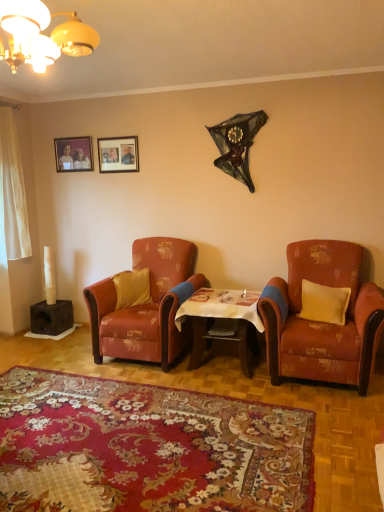
Identify the location of floral carpet at center. (147, 448).

Measure the distance between yellow fabric pillow at center, the second pillow when ordered from right to left, and camera.

yellow fabric pillow at center, the second pillow when ordered from right to left, and camera are 3.79 meters apart from each other.

This screenshot has width=384, height=512. Describe the element at coordinates (132, 288) in the screenshot. I see `yellow fabric pillow at center, the second pillow when ordered from right to left` at that location.

Find the location of a particular element. distressed fabric armchair at center, placed as the second chair when sorted from right to left is located at coordinates (145, 306).

Can you confirm if yellow fabric pillow at center, the second pillow when ordered from right to left, is smaller than floral carpet at center?

Yes.

Which is more to the right, yellow fabric pillow at center, the second pillow when ordered from right to left, or floral carpet at center?

floral carpet at center is more to the right.

Consider the image. From the image's perspective, relative to floral carpet at center, is yellow fabric pillow at center, the second pillow when ordered from right to left, above or below?

Clearly, from the image's perspective, yellow fabric pillow at center, the second pillow when ordered from right to left, is above floral carpet at center.

Is yellow velvet pillow at right, the second pillow positioned from the back, in contact with matte wooden picture frame at upper left, which ranks as the first picture frame in left-to-right order?

There is a gap between yellow velvet pillow at right, the second pillow positioned from the back, and matte wooden picture frame at upper left, which ranks as the first picture frame in left-to-right order.

Is yellow velvet pillow at right, which ranks as the 1th pillow in front-to-back order, inside or outside of matte wooden picture frame at upper left, which ranks as the second picture frame in right-to-left order?

yellow velvet pillow at right, which ranks as the 1th pillow in front-to-back order, is located beyond the bounds of matte wooden picture frame at upper left, which ranks as the second picture frame in right-to-left order.

From a real-world perspective, who is located higher, yellow velvet pillow at right, which ranks as the 1th pillow in front-to-back order, or matte wooden picture frame at upper left, which ranks as the first picture frame in left-to-right order?

matte wooden picture frame at upper left, which ranks as the first picture frame in left-to-right order, from a real-world perspective.

Is yellow velvet pillow at right, which ranks as the 1th pillow in front-to-back order, oriented towards matte wooden picture frame at upper left, which ranks as the second picture frame in right-to-left order?

No, yellow velvet pillow at right, which ranks as the 1th pillow in front-to-back order, does not turn towards matte wooden picture frame at upper left, which ranks as the second picture frame in right-to-left order.

Considering the relative sizes of distressed fabric armchair at center, the first chair from the left, and wooden table at center in the image provided, is distressed fabric armchair at center, the first chair from the left, bigger than wooden table at center?

Correct, distressed fabric armchair at center, the first chair from the left, is larger in size than wooden table at center.

Considering the positions of points (187, 264) and (204, 342), is point (187, 264) farther from camera compared to point (204, 342)?

Yes, it is.

In the scene shown: Is distressed fabric armchair at center, placed as the second chair when sorted from right to left, not within wooden table at center?

distressed fabric armchair at center, placed as the second chair when sorted from right to left, lies outside wooden table at center's area.

How far apart are distressed fabric armchair at center, the first chair from the left, and wooden table at center?

distressed fabric armchair at center, the first chair from the left, and wooden table at center are 15.21 inches apart from each other.

Considering the positions of point (150, 245) and point (32, 49), is point (150, 245) closer or farther from the camera than point (32, 49)?

Point (150, 245) is farther from the camera than point (32, 49).

Identify the location of the 1st chair counting from the right side of the metallic yellow chandelier at upper left. The image size is (384, 512). (145, 306).

Is distressed fabric armchair at center, the first chair from the left, oriented away from metallic yellow chandelier at upper left?

distressed fabric armchair at center, the first chair from the left, is not turned away from metallic yellow chandelier at upper left.

From the image's perspective, which is below, distressed fabric armchair at center, placed as the second chair when sorted from right to left, or metallic yellow chandelier at upper left?

distressed fabric armchair at center, placed as the second chair when sorted from right to left, from the image's perspective.

How many degrees apart are the facing directions of matte wooden picture frame at upper center, acting as the second picture frame starting from the left, and metallic yellow chandelier at upper left?

The angle between the facing direction of matte wooden picture frame at upper center, acting as the second picture frame starting from the left, and the facing direction of metallic yellow chandelier at upper left is 90 degrees.

Does matte wooden picture frame at upper center, which is the 1th picture frame in right-to-left order, lie behind metallic yellow chandelier at upper left?

Yes, the depth of matte wooden picture frame at upper center, which is the 1th picture frame in right-to-left order, is greater than that of metallic yellow chandelier at upper left.

Which of these two, matte wooden picture frame at upper center, acting as the second picture frame starting from the left, or metallic yellow chandelier at upper left, is smaller?

matte wooden picture frame at upper center, acting as the second picture frame starting from the left.

Which object is positioned more to the right, matte wooden picture frame at upper center, which is the 1th picture frame in right-to-left order, or metallic yellow chandelier at upper left?

Positioned to the right is metallic yellow chandelier at upper left.

From the image's perspective, is yellow fabric pillow at center, the second pillow when ordered from right to left, on distressed orange fabric armchair at right, the first chair from the right?

Yes, from the image's perspective, yellow fabric pillow at center, the second pillow when ordered from right to left, is over distressed orange fabric armchair at right, the first chair from the right.

Starting from the yellow fabric pillow at center, placed as the first pillow when sorted from back to front, which chair is the 2nd one in front? Please provide its 2D coordinates.

[(324, 323)]

Is distressed orange fabric armchair at right, arranged as the second chair when viewed from the left, inside yellow fabric pillow at center, placed as the first pillow when sorted from back to front?

Definitely not — distressed orange fabric armchair at right, arranged as the second chair when viewed from the left, is not inside yellow fabric pillow at center, placed as the first pillow when sorted from back to front.

Which of these two, yellow fabric pillow at center, which is the first pillow in left-to-right order, or distressed orange fabric armchair at right, the first chair from the right, is bigger?

distressed orange fabric armchair at right, the first chair from the right.

Is floral carpet at center placed right next to distressed fabric armchair at center, the first chair from the left?

No, floral carpet at center is not with distressed fabric armchair at center, the first chair from the left.

Is floral carpet at center oriented towards distressed fabric armchair at center, the first chair from the left?

No.

Is the position of floral carpet at center less distant than that of distressed fabric armchair at center, the first chair from the left?

Yes, it is in front of distressed fabric armchair at center, the first chair from the left.

From the image's perspective, which is above, floral carpet at center or distressed fabric armchair at center, the first chair from the left?

distressed fabric armchair at center, the first chair from the left.

Where is `the 2nd pillow positioned above the floral carpet at center (from a real-world perspective)`? Image resolution: width=384 pixels, height=512 pixels. the 2nd pillow positioned above the floral carpet at center (from a real-world perspective) is located at coordinates (132, 288).

Which picture frame is the 2nd one when counting from the left side of the yellow velvet pillow at right, which ranks as the 1th pillow in front-to-back order? Please provide its 2D coordinates.

[(73, 154)]

Based on their spatial positions, is wooden table at center or yellow fabric pillow at center, which is the first pillow in left-to-right order, closer to metallic yellow chandelier at upper left?

yellow fabric pillow at center, which is the first pillow in left-to-right order, is positioned closer to the anchor metallic yellow chandelier at upper left.

Consider the image. When comparing their distances from distressed fabric armchair at center, the first chair from the left, does wooden table at center or matte wooden picture frame at upper center, acting as the second picture frame starting from the left, seem closer?

Based on the image, wooden table at center appears to be nearer to distressed fabric armchair at center, the first chair from the left.

When comparing their distances from metallic yellow chandelier at upper left, does matte wooden picture frame at upper center, which is the 1th picture frame in right-to-left order, or distressed fabric armchair at center, placed as the second chair when sorted from right to left, seem closer?

distressed fabric armchair at center, placed as the second chair when sorted from right to left.

Looking at the image, which one is located further to floral carpet at center, wooden table at center or matte wooden picture frame at upper left, which ranks as the first picture frame in left-to-right order?

matte wooden picture frame at upper left, which ranks as the first picture frame in left-to-right order, is further to floral carpet at center.

Looking at this image, which object lies nearer to the anchor point yellow velvet pillow at right, the second pillow positioned from the back, matte wooden picture frame at upper center, which is the 1th picture frame in right-to-left order, or distressed orange fabric armchair at right, arranged as the second chair when viewed from the left?

Among the two, distressed orange fabric armchair at right, arranged as the second chair when viewed from the left, is located nearer to yellow velvet pillow at right, the second pillow positioned from the back.

Estimate the real-world distances between objects in this image. Which object is further from metallic yellow chandelier at upper left, yellow velvet pillow at right, the first pillow from the right, or matte wooden picture frame at upper left, which ranks as the first picture frame in left-to-right order?

yellow velvet pillow at right, the first pillow from the right.

Which object lies further to the anchor point yellow velvet pillow at right, arranged as the 2th pillow when viewed from the left, metallic yellow chandelier at upper left or yellow fabric pillow at center, the second pillow when ordered from right to left?

metallic yellow chandelier at upper left is further to yellow velvet pillow at right, arranged as the 2th pillow when viewed from the left.

Looking at the image, which one is located closer to yellow velvet pillow at right, the first pillow from the right, yellow fabric pillow at center, placed as the first pillow when sorted from back to front, or wooden table at center?

Based on the image, wooden table at center appears to be nearer to yellow velvet pillow at right, the first pillow from the right.

Find the location of a particular element. Image resolution: width=384 pixels, height=512 pixels. plain between metallic yellow chandelier at upper left and distressed fabric armchair at center, placed as the second chair when sorted from right to left, in the front-back direction is located at coordinates (147, 448).

Locate an element on the screen. table between metallic yellow chandelier at upper left and yellow velvet pillow at right, the first pillow from the right, in the front-back direction is located at coordinates (223, 323).

You are a GUI agent. You are given a task and a screenshot of the screen. Output one action in this format:
    pyautogui.click(x=<x>, y=<y>)
    Task: Click on the picture frame between floral carpet at center and matte wooden picture frame at upper left, which ranks as the first picture frame in left-to-right order, along the z-axis
    The height and width of the screenshot is (512, 384).
    Given the screenshot: What is the action you would take?
    pyautogui.click(x=118, y=154)

Where is `picture frame between matte wooden picture frame at upper left, which ranks as the first picture frame in left-to-right order, and wooden table at center from top to bottom`? The width and height of the screenshot is (384, 512). picture frame between matte wooden picture frame at upper left, which ranks as the first picture frame in left-to-right order, and wooden table at center from top to bottom is located at coordinates (118, 154).